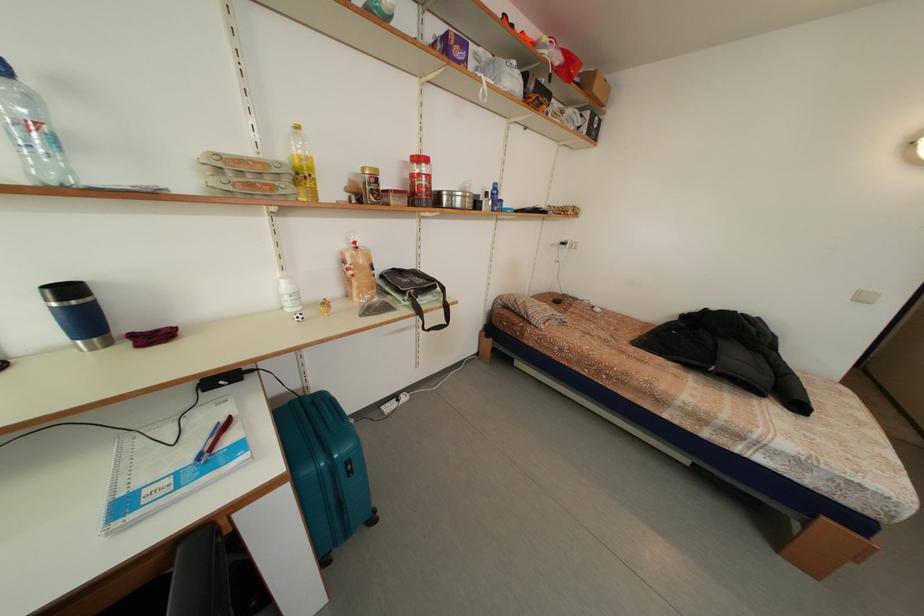
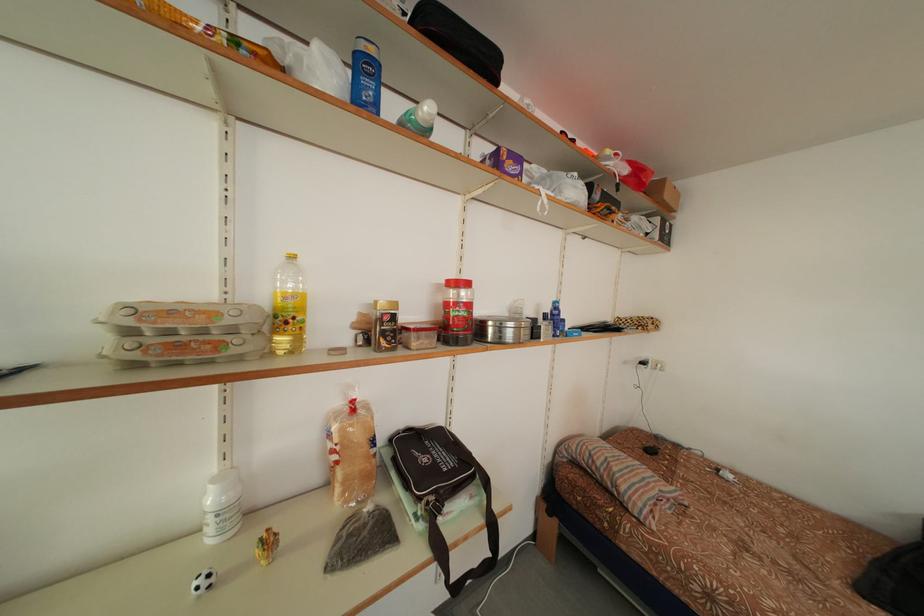
Where in the second image is the point corresponding to [383,304] from the first image?

(378, 513)